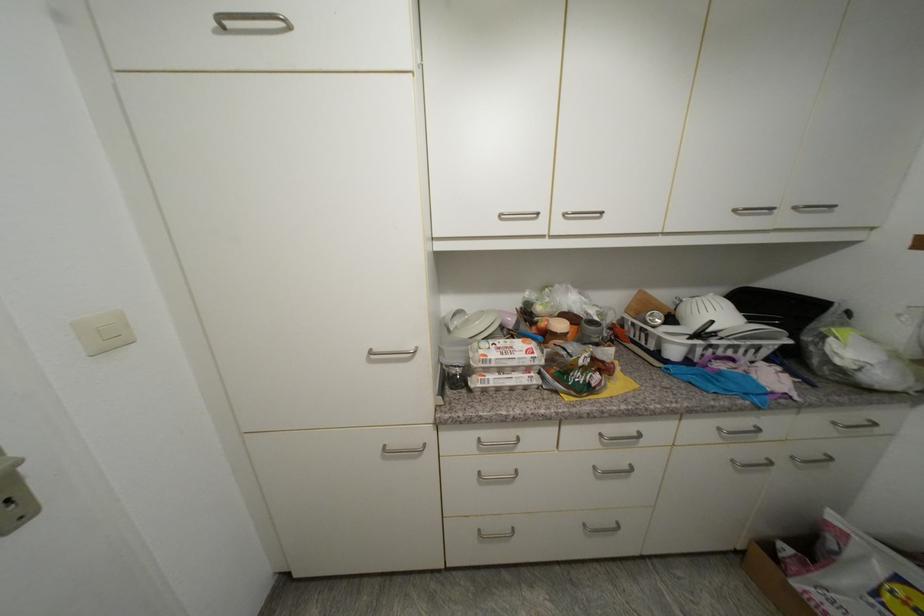
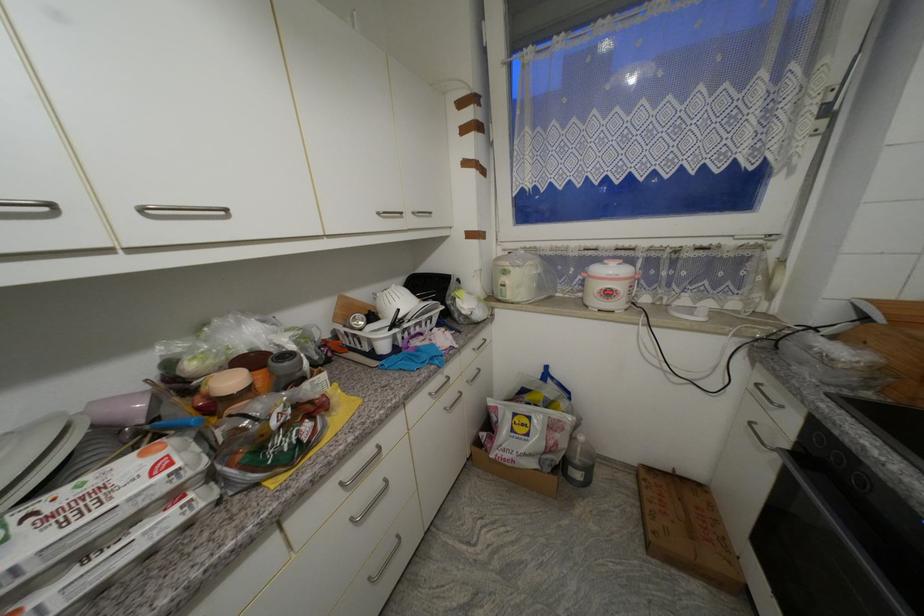
Find the pixel in the second image that matches (x=736, y=355) in the first image.

(423, 331)